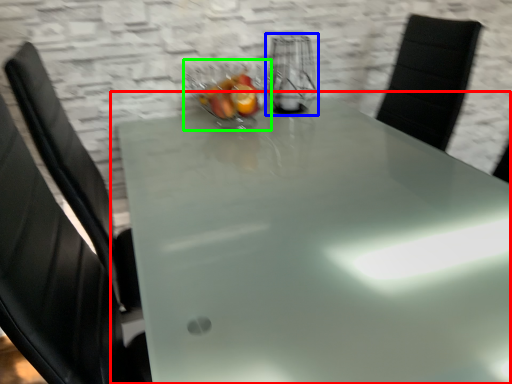
Question: Considering the real-world distances, which object is closest to table (highlighted by a red box)? appliance (highlighted by a blue box) or glass bowl (highlighted by a green box).

Choices:
 (A) appliance
 (B) glass bowl

Answer: (B)